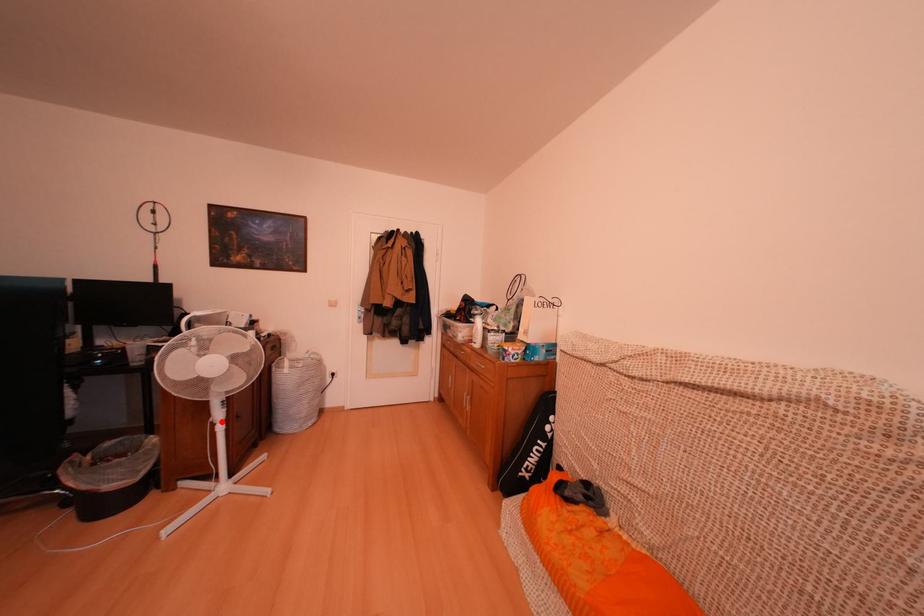
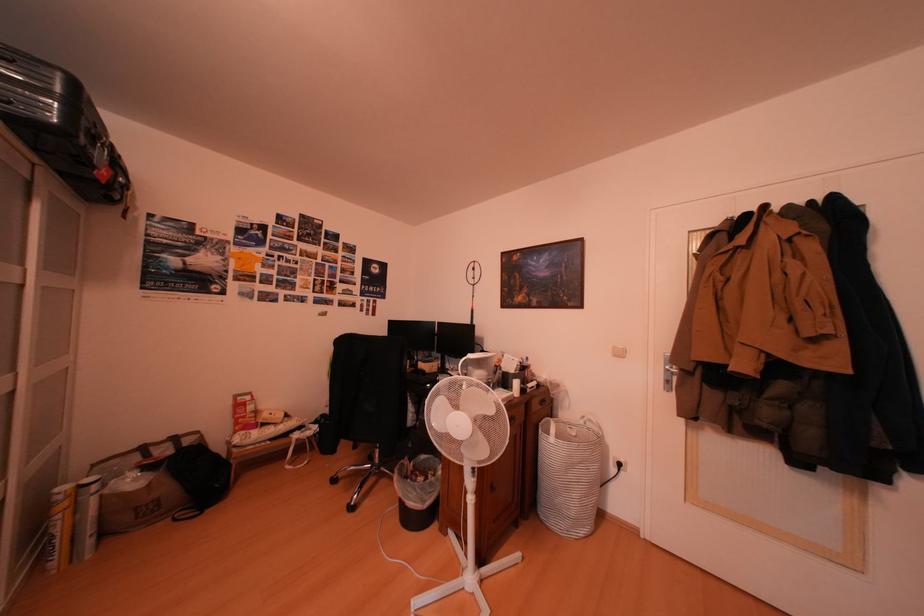
In the second image, find the point that corresponds to the highlighted location in the first image.

(476, 485)